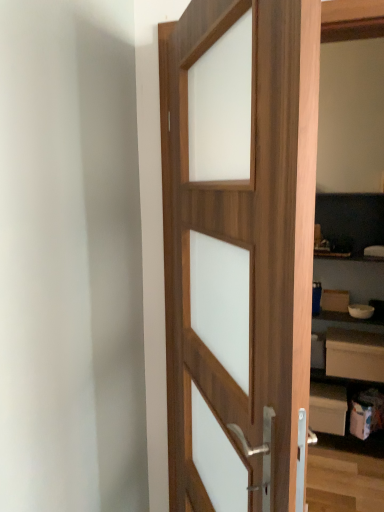
In order to click on white matte drawer at lower right in this screenshot , I will do `click(355, 355)`.

The width and height of the screenshot is (384, 512). Find the location of `white matte drawer at lower right`. white matte drawer at lower right is located at coordinates (355, 355).

What's the angular difference between wooden door at center and white matte drawer at lower right's facing directions?

The angle between the facing direction of wooden door at center and the facing direction of white matte drawer at lower right is 90.1 degrees.

Considering the sizes of objects wooden door at center and white matte drawer at lower right in the image provided, who is bigger, wooden door at center or white matte drawer at lower right?

Bigger between the two is wooden door at center.

Would you consider wooden door at center to be distant from white matte drawer at lower right?

Yes, wooden door at center is far from white matte drawer at lower right.

Can we say wooden door at center lies outside white matte drawer at lower right?

Yes, wooden door at center is not within white matte drawer at lower right.

Which is farther from the camera, [347,374] or [340,209]?

The point [340,209] is farther.

Considering the relative sizes of white matte drawer at lower right and white matte bookshelf at right in the image provided, is white matte drawer at lower right wider than white matte bookshelf at right?

In fact, white matte drawer at lower right might be narrower than white matte bookshelf at right.

From the image's perspective, is white matte drawer at lower right above or below white matte bookshelf at right?

Clearly, from the image's perspective, white matte drawer at lower right is below white matte bookshelf at right.

There is a white matte drawer at lower right. Where is `bookshelf above it (from a real-world perspective)`? bookshelf above it (from a real-world perspective) is located at coordinates (349, 294).

Considering the relative sizes of white matte bookshelf at right and wooden door at center in the image provided, is white matte bookshelf at right bigger than wooden door at center?

Actually, white matte bookshelf at right might be smaller than wooden door at center.

Does white matte bookshelf at right touch wooden door at center?

white matte bookshelf at right is not next to wooden door at center, and they're not touching.

From a real-world perspective, is white matte bookshelf at right physically located above or below wooden door at center?

In terms of real-world spatial position, white matte bookshelf at right is below wooden door at center.

Which is behind, point (381, 430) or point (251, 296)?

Positioned behind is point (381, 430).

Is white matte bookshelf at right aimed at white matte drawer at lower right?

Yes, white matte bookshelf at right is aimed at white matte drawer at lower right.

Between white matte bookshelf at right and white matte drawer at lower right, which one has larger size?

white matte bookshelf at right is bigger.

Is white matte bookshelf at right inside the boundaries of white matte drawer at lower right, or outside?

white matte bookshelf at right is outside white matte drawer at lower right.

Would you say white matte bookshelf at right is a long distance from white matte drawer at lower right?

They are positioned close to each other.

Are white matte drawer at lower right and wooden door at center located far from each other?

Yes, white matte drawer at lower right and wooden door at center are located far from each other.

Is wooden door at center a part of white matte drawer at lower right?

No, wooden door at center is not inside white matte drawer at lower right.

Considering the relative positions of white matte drawer at lower right and wooden door at center in the image provided, is white matte drawer at lower right to the left or to the right of wooden door at center?

From the image, it's evident that white matte drawer at lower right is to the right of wooden door at center.

From the image's perspective, which one is positioned higher, wooden door at center or white matte bookshelf at right?

From the image's view, wooden door at center is above.

Does wooden door at center touch white matte bookshelf at right?

wooden door at center and white matte bookshelf at right are clearly separated.

Which is behind, point (251, 484) or point (339, 282)?

Point (339, 282)

From a real-world perspective, which is physically above, wooden door at center or white matte bookshelf at right?

From a 3D spatial view, wooden door at center is above.

In order to click on door in front of the white matte drawer at lower right in this screenshot , I will do `click(244, 243)`.

Image resolution: width=384 pixels, height=512 pixels. Identify the location of drawer beneath the white matte bookshelf at right (from a real-world perspective). tap(355, 355).

From the image, which object appears to be farther from white matte bookshelf at right, white matte drawer at lower right or wooden door at center?

wooden door at center is further to white matte bookshelf at right.

Considering their positions, is white matte drawer at lower right positioned closer to wooden door at center than white matte bookshelf at right?

white matte bookshelf at right is positioned closer to the anchor wooden door at center.

Considering their positions, is wooden door at center positioned closer to white matte bookshelf at right than white matte drawer at lower right?

Based on the image, white matte drawer at lower right appears to be nearer to white matte bookshelf at right.

When comparing their distances from wooden door at center, does white matte bookshelf at right or white matte drawer at lower right seem closer?

The object closer to wooden door at center is white matte bookshelf at right.

Based on their spatial positions, is white matte bookshelf at right or wooden door at center closer to white matte drawer at lower right?

white matte bookshelf at right lies closer to white matte drawer at lower right than the other object.

Estimate the real-world distances between objects in this image. Which object is further from white matte drawer at lower right, wooden door at center or white matte bookshelf at right?

wooden door at center is further to white matte drawer at lower right.

Where is `bookshelf between wooden door at center and white matte drawer at lower right from front to back`? This screenshot has width=384, height=512. bookshelf between wooden door at center and white matte drawer at lower right from front to back is located at coordinates [x=349, y=294].